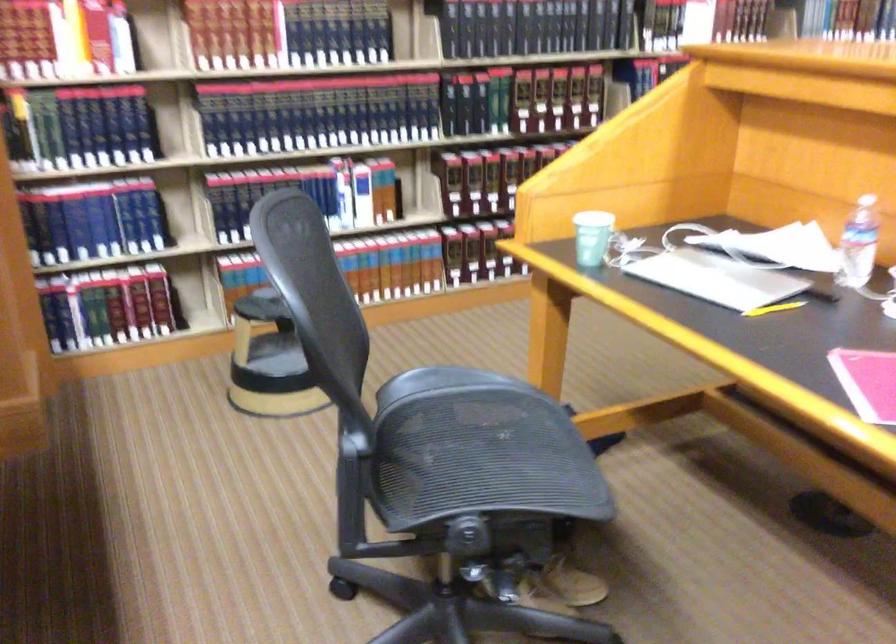
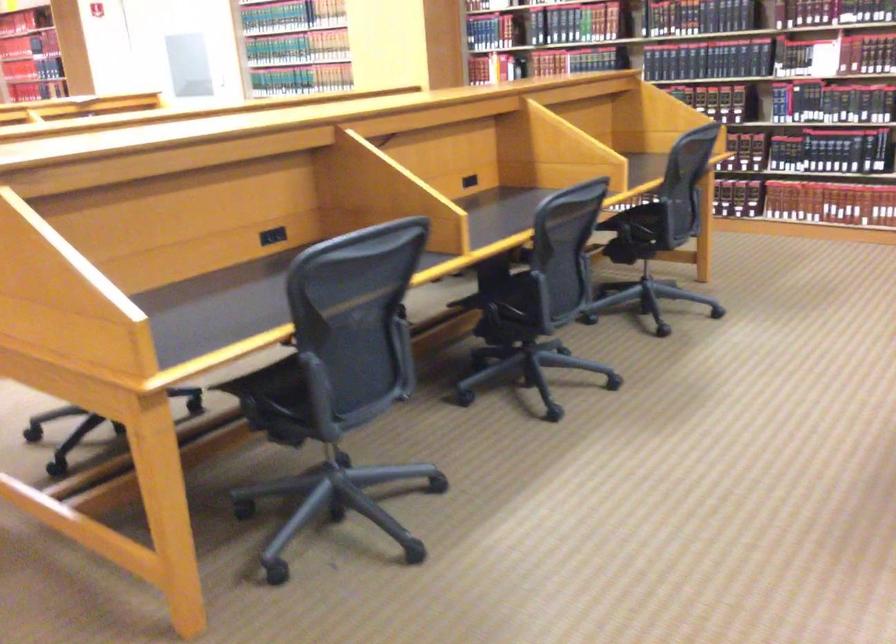
Question: I am providing you with two images of the same scene from different viewpoints. Which of the following objects are not visible in image2?

Choices:
 (A) vertical metal handle
 (B) closed silver laptop
 (C) hardcover book
 (D) black power outlet

Answer: (B)